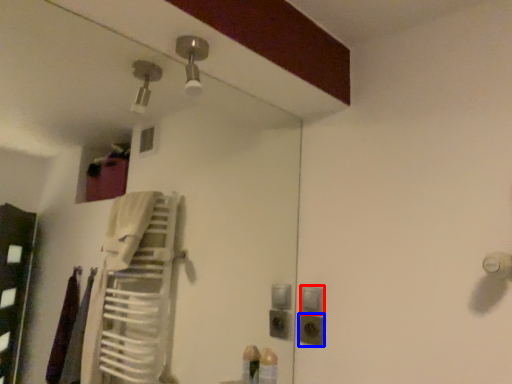
Question: Which object appears farthest to the camera in this image, light switch (highlighted by a red box) or electric outlet (highlighted by a blue box)?

Choices:
 (A) light switch
 (B) electric outlet

Answer: (A)